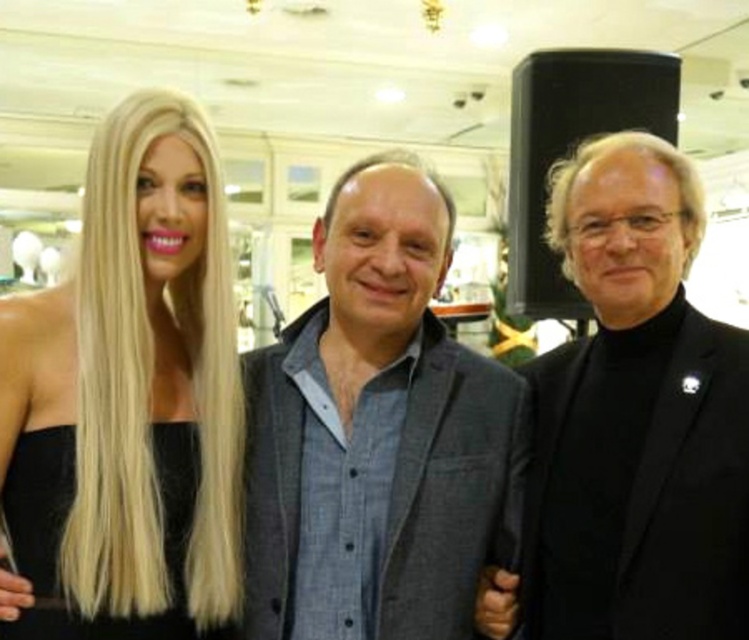
Which is more to the right, gray textured blazer at center or black matte suit at center?

black matte suit at center is more to the right.

Can you confirm if gray textured blazer at center is positioned below black matte suit at center?

Correct, gray textured blazer at center is located below black matte suit at center.

At what (x,y) coordinates should I click in order to perform the action: click on gray textured blazer at center. Please return your answer as a coordinate pair (x, y). The height and width of the screenshot is (640, 749). Looking at the image, I should click on (377, 433).

Does gray textured blazer at center have a smaller size compared to blonde hair at left?

Incorrect, gray textured blazer at center is not smaller in size than blonde hair at left.

Does gray textured blazer at center have a greater width compared to blonde hair at left?

Correct, the width of gray textured blazer at center exceeds that of blonde hair at left.

Between point (445, 237) and point (82, 429), which one is positioned behind?

Positioned behind is point (445, 237).

In order to click on gray textured blazer at center in this screenshot , I will do `click(377, 433)`.

Does black matte suit at center appear on the right side of blonde hair at left?

Yes, black matte suit at center is to the right of blonde hair at left.

The image size is (749, 640). Describe the element at coordinates (636, 417) in the screenshot. I see `black matte suit at center` at that location.

The height and width of the screenshot is (640, 749). Find the location of `black matte suit at center`. black matte suit at center is located at coordinates (636, 417).